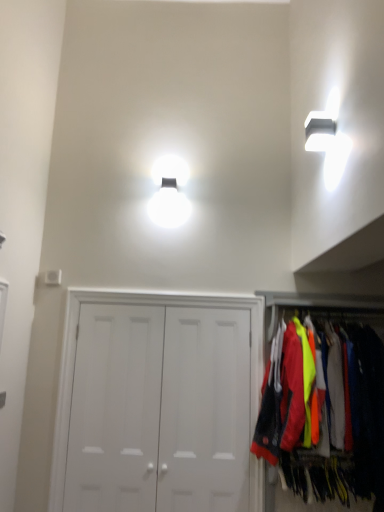
Question: In the image, is white matte door at center, the third door in the right-to-left sequence, positioned in front of or behind white matte door at center, marked as the third door in a left-to-right arrangement?

Choices:
 (A) behind
 (B) front

Answer: (A)

Question: Is white matte door at center, the third door in the right-to-left sequence, situated inside white matte door at center, which appears as the first door when viewed from the right, or outside?

Choices:
 (A) inside
 (B) outside

Answer: (B)

Question: Estimate the real-world distances between objects in this image. Which object is farther from the white matte door at center, the second door positioned from the left?

Choices:
 (A) white matte door at center, the third door in the right-to-left sequence
 (B) neon yellow fabric at right
 (C) white matte door at center, marked as the third door in a left-to-right arrangement

Answer: (B)

Question: Which is nearer to the white matte door at center, the second door positioned from the left?

Choices:
 (A) neon yellow fabric at right
 (B) white matte door at center, placed as the 1th door when sorted from left to right
 (C) white matte door at center, which appears as the first door when viewed from the right

Answer: (B)